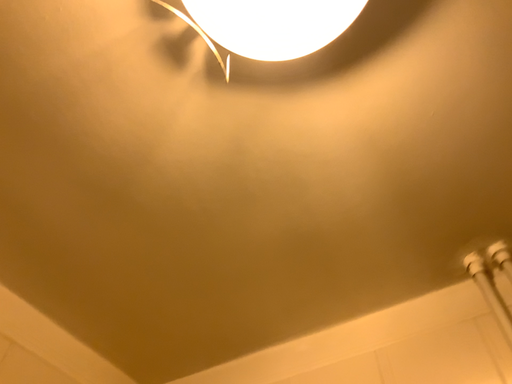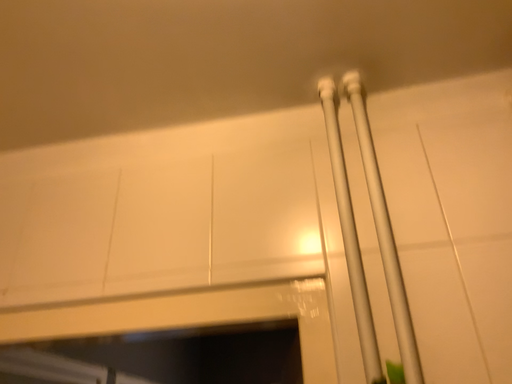
Question: Which way did the camera rotate in the video?

Choices:
 (A) rotated upward
 (B) rotated downward

Answer: (B)